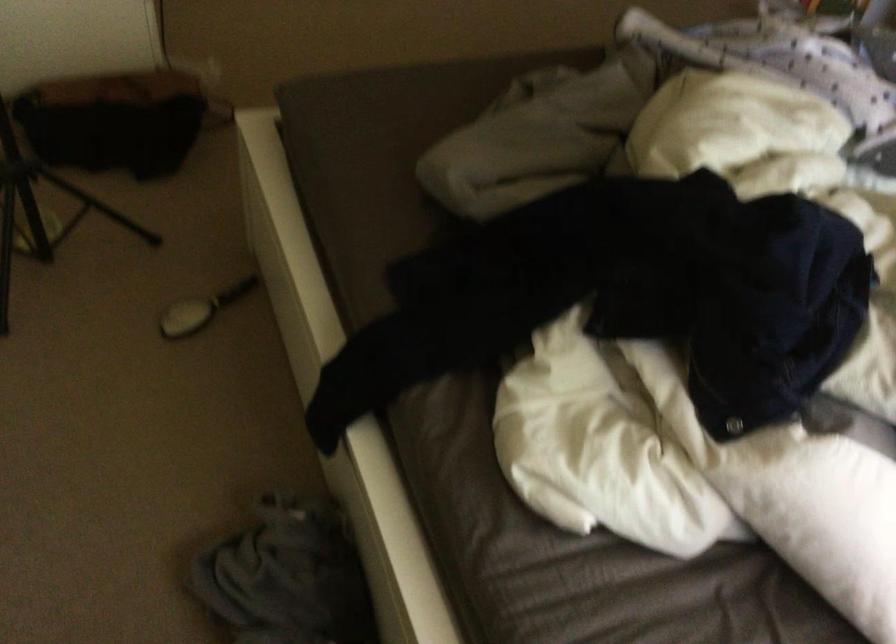
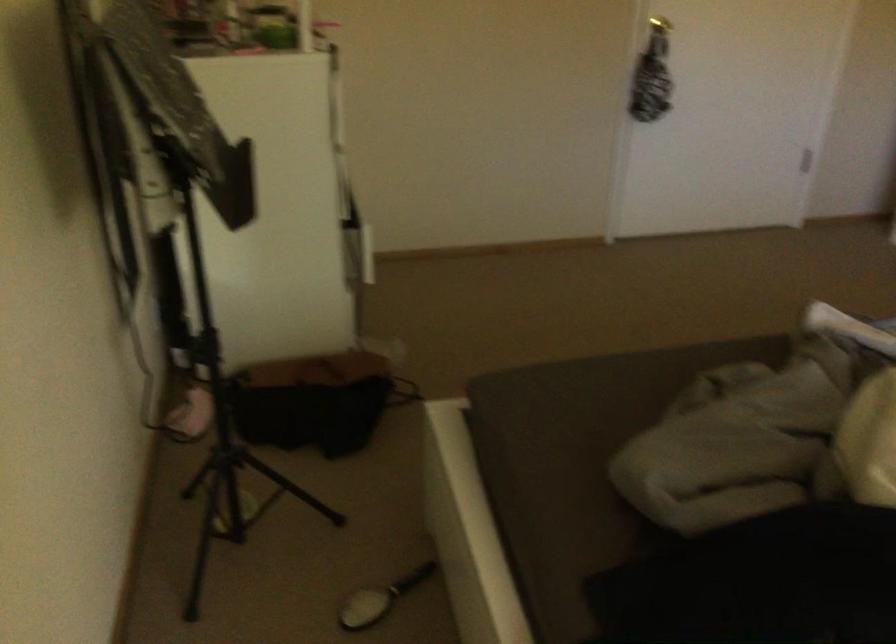
In the second image, find the point that corresponds to [197,310] in the first image.

(380, 599)